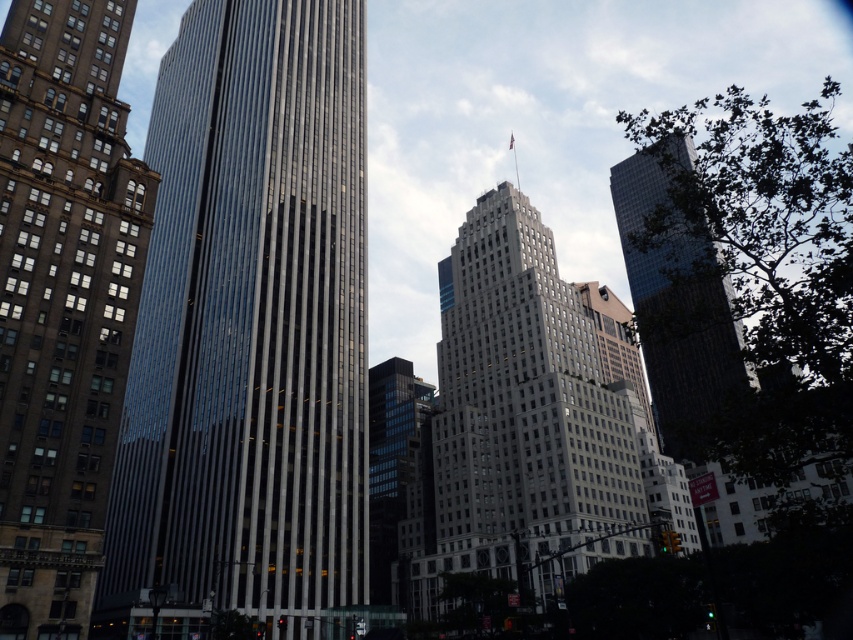
Question: Considering the real-world distances, which object is closest to the glassy reflective skyscraper at upper right?

Choices:
 (A) reflective glass skyscraper at center
 (B) brown stone building at left

Answer: (A)

Question: Which object is positioned farthest from the reflective glass skyscraper at center?

Choices:
 (A) brown stone building at left
 (B) glassy reflective skyscraper at upper right

Answer: (B)

Question: Does brown stone building at left have a smaller size compared to glassy reflective skyscraper at upper right?

Choices:
 (A) yes
 (B) no

Answer: (A)

Question: Is brown stone building at left in front of glassy reflective skyscraper at upper right?

Choices:
 (A) yes
 (B) no

Answer: (B)

Question: Is reflective glass skyscraper at center above glassy reflective skyscraper at upper right?

Choices:
 (A) no
 (B) yes

Answer: (B)

Question: Among these objects, which one is nearest to the camera?

Choices:
 (A) reflective glass skyscraper at center
 (B) glassy reflective skyscraper at upper right
 (C) brown stone building at left

Answer: (B)